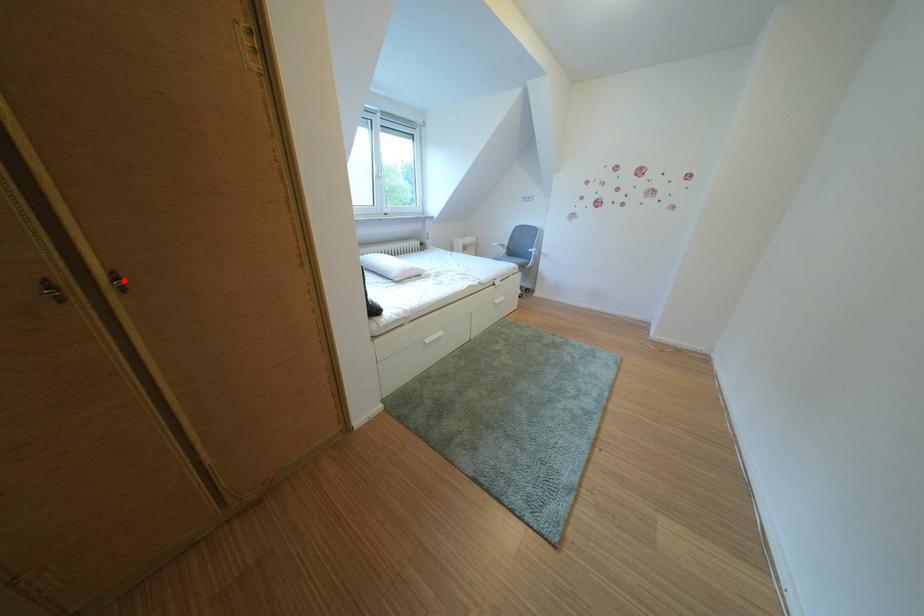
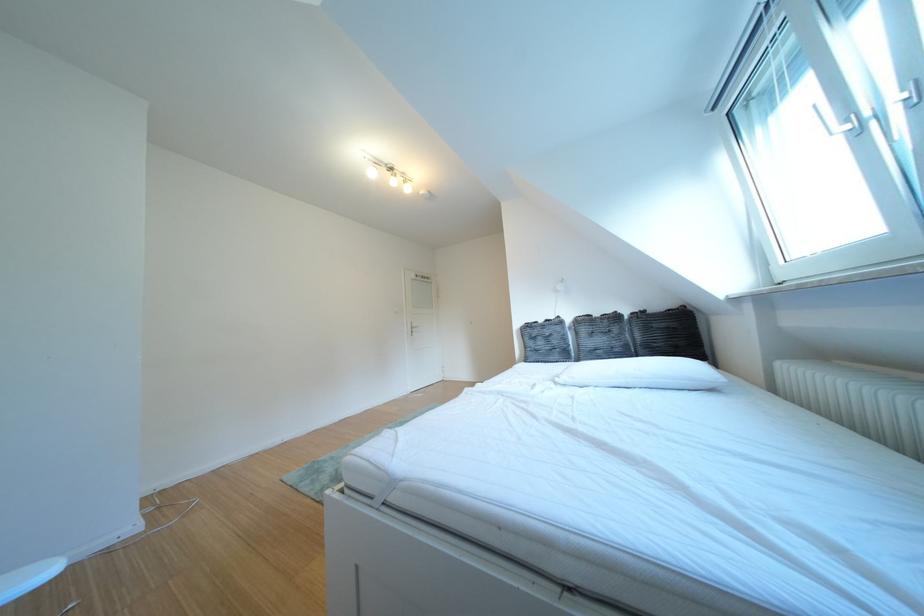
Question: I am providing you with two images of the same scene from different viewpoints. A red point is marked on the first image. Can you still see the location of the red point in image 2?

Choices:
 (A) Yes
 (B) No

Answer: (B)